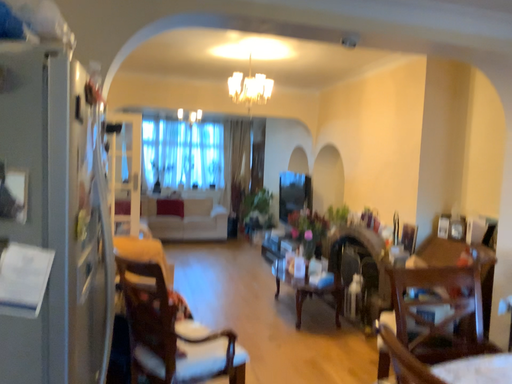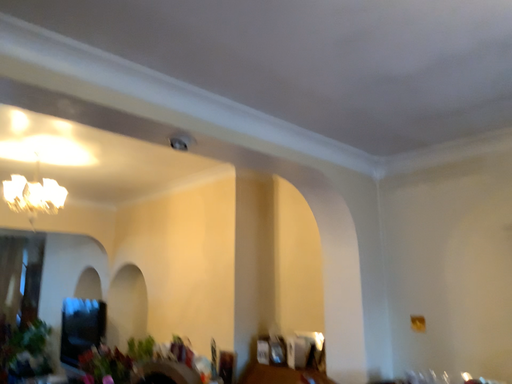
Question: How did the camera likely rotate when shooting the video?

Choices:
 (A) rotated upward
 (B) rotated downward

Answer: (A)